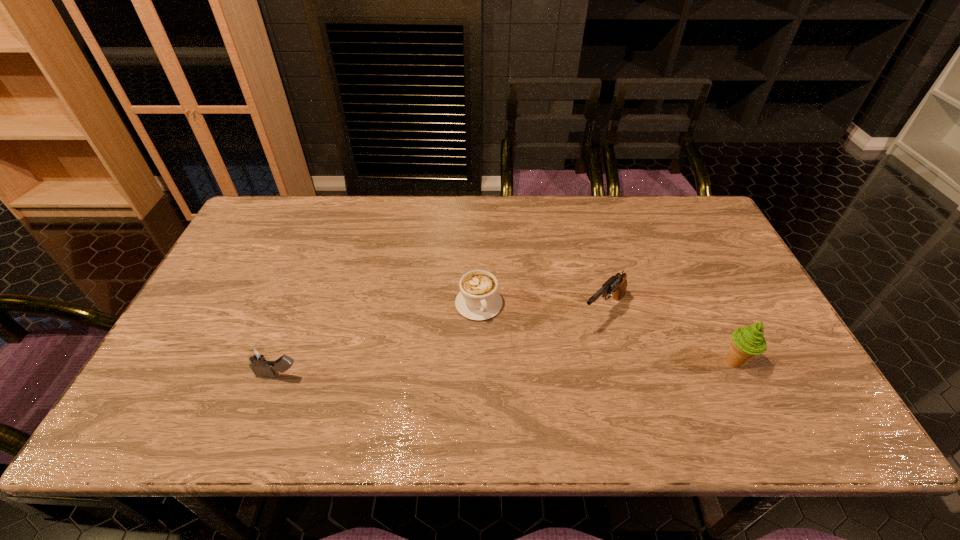
This screenshot has height=540, width=960. In order to click on free space that is in between the leftmost object and the second object from right to left in this screenshot , I will do `click(442, 343)`.

Where is `free spot between the tallest object and the shortest object`? Image resolution: width=960 pixels, height=540 pixels. free spot between the tallest object and the shortest object is located at coordinates (607, 333).

Where is `the closest object to the rightmost object`? Image resolution: width=960 pixels, height=540 pixels. the closest object to the rightmost object is located at coordinates (617, 284).

Identify the location of object that can be found as the closest to the second object from right to left. (746, 342).

Identify the location of free space in the image that satisfies the following two spatial constraints: 1. on the back side of the igniter; 2. on the left side of the third object from left to right. This screenshot has width=960, height=540. (303, 310).

The image size is (960, 540). What are the coordinates of `free region that satisfies the following two spatial constraints: 1. on the front side of the cappuccino; 2. on the left side of the rightmost object` in the screenshot? It's located at pyautogui.click(x=479, y=362).